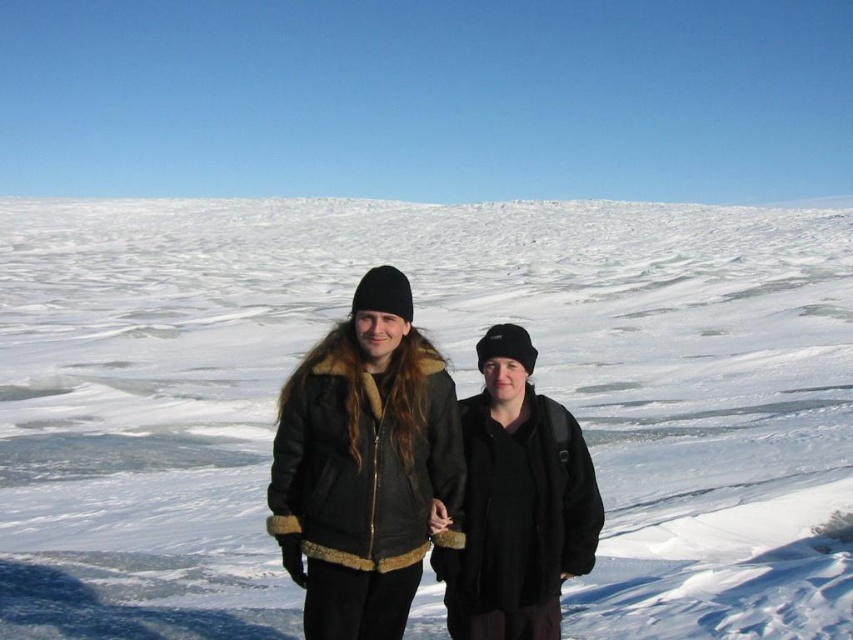
From the picture: You are standing in the snowy landscape shown in the image. There is a point at coordinates (457, 388). What is located at this point?

The white fluffy snow at center is located at point (457, 388).

You are an observer in the snowy landscape. You notice the white fluffy snow at center and the black matte jacket at center. Which object is located above the other?

The white fluffy snow at center is positioned over the black matte jacket at center.